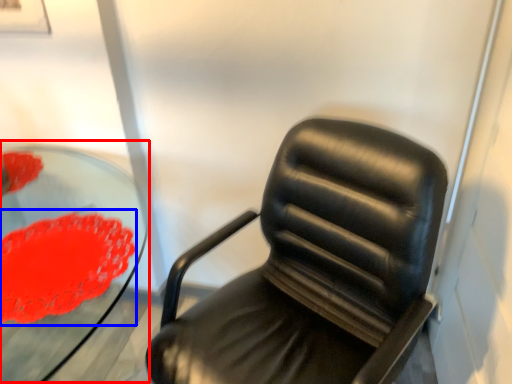
Question: Which object appears farthest to the camera in this image, round table (highlighted by a red box) or flower (highlighted by a blue box)?

Choices:
 (A) round table
 (B) flower

Answer: (B)